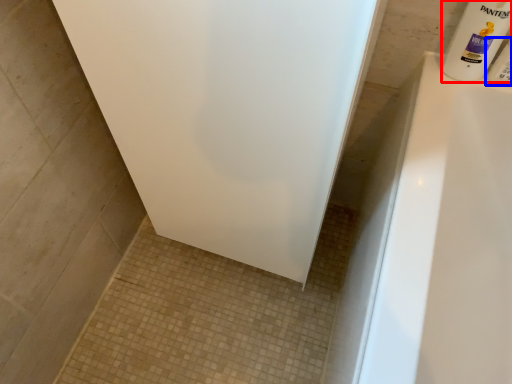
Question: Which object is closer to the camera taking this photo, cleaning product (highlighted by a red box) or toiletry (highlighted by a blue box)?

Choices:
 (A) cleaning product
 (B) toiletry

Answer: (A)